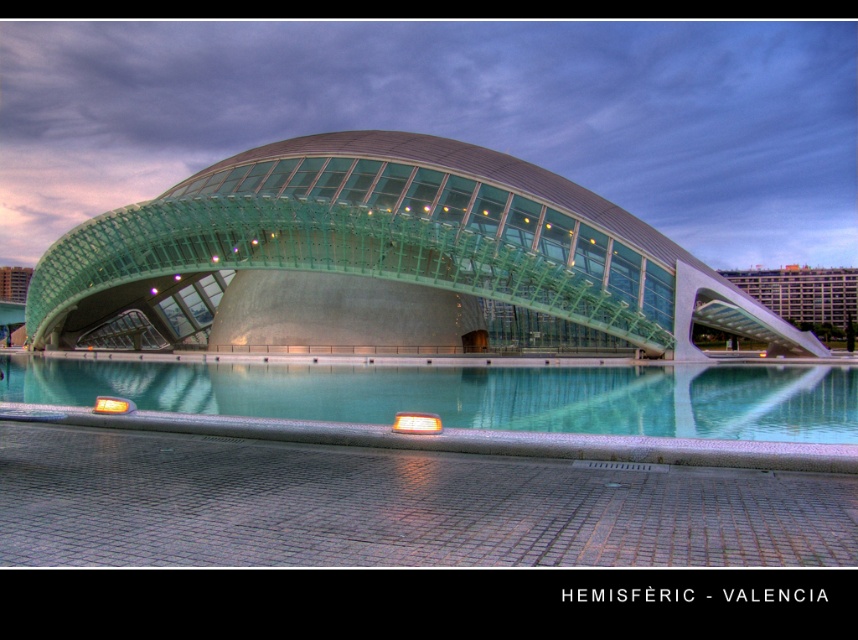
You are standing in front of the Hemisfereic building and want to take a photo of both the transparent glass dome at center and the clear glass water at center. Which object should you focus on first to ensure both are in the frame?

You should focus on the transparent glass dome at center first because it is positioned over the clear glass water at center, so by centering the dome in your viewfinder, the water will naturally be included below it.

You are standing in front of the Hemisfere building and want to take a photo of both the transparent glass dome at center and the green glass building at right. Which one should you point your camera towards first to capture both in the frame?

You should point your camera towards the transparent glass dome at center first because it is to the left of the green glass building at right, so capturing it first will ensure both are in the frame.

Looking at this image, you are standing in front of the Hemisfereic building and want to take a photo of the clear glass water at center and the green glass building at right. Which object should you zoom in more on to capture both in the frame?

You should zoom in more on the green glass building at right because the clear glass water at center is smaller in size compared to the green glass building at right, so adjusting focus on the larger object allows both to fit within the frame.